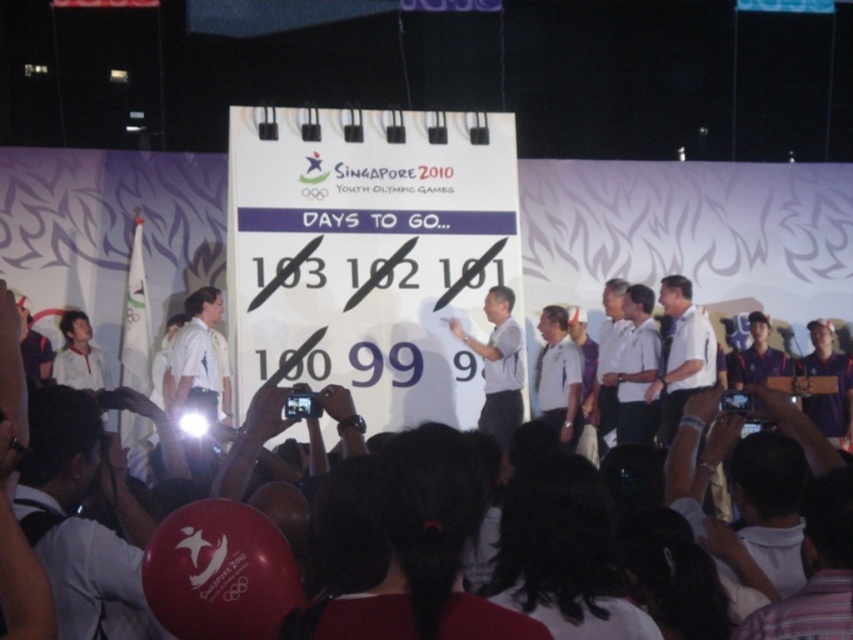
Can you confirm if white smooth shirt at center is positioned to the left of gray matte shirt at center?

Incorrect, white smooth shirt at center is not on the left side of gray matte shirt at center.

Is white smooth shirt at center to the right of gray matte shirt at center from the viewer's perspective?

Indeed, white smooth shirt at center is positioned on the right side of gray matte shirt at center.

Where is `white smooth shirt at center`? white smooth shirt at center is located at coordinates (682, 353).

The width and height of the screenshot is (853, 640). Find the location of `white smooth shirt at center`. white smooth shirt at center is located at coordinates (682, 353).